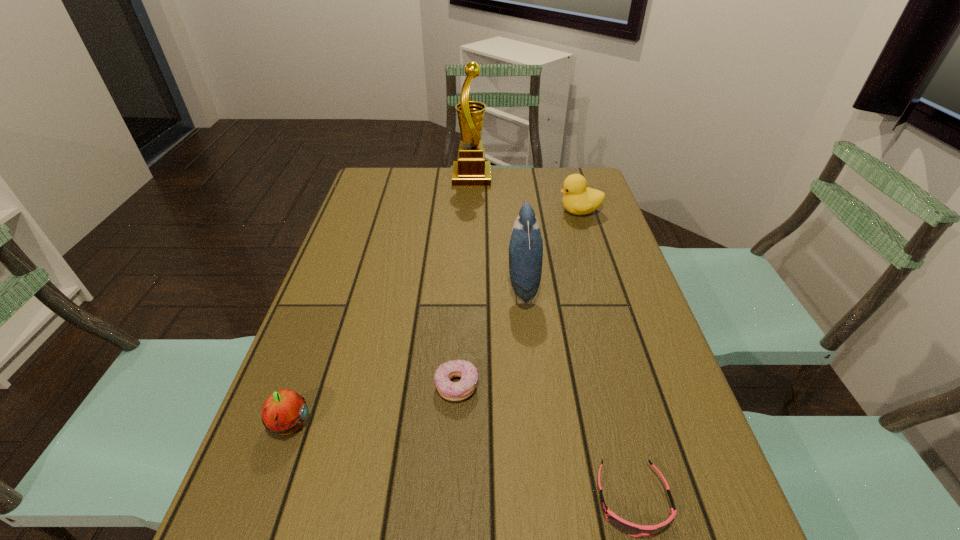
Identify the location of vacant space that's between the fourth object from left to right and the fourth shortest object. This screenshot has width=960, height=540. (551, 248).

You are a GUI agent. You are given a task and a screenshot of the screen. Output one action in this format:
    pyautogui.click(x=<x>, y=<y>)
    Task: Click on the vacant area between the apple and the tallest object
    
    Given the screenshot: What is the action you would take?
    pyautogui.click(x=380, y=301)

Where is `unoccupied area between the third tallest object and the third object from right to left`? unoccupied area between the third tallest object and the third object from right to left is located at coordinates (551, 248).

Identify which object is the nearest to the bird. Please provide its 2D coordinates. Your answer should be formatted as a tuple, i.e. [(x, y)], where the tuple contains the x and y coordinates of a point satisfying the conditions above.

[(453, 391)]

Identify which object is the nearest to the goggles. Please provide its 2D coordinates. Your answer should be formatted as a tuple, i.e. [(x, y)], where the tuple contains the x and y coordinates of a point satisfying the conditions above.

[(453, 391)]

Locate an element on the screen. free spot that satisfies the following two spatial constraints: 1. on the front-facing side of the farthest object; 2. on the front side of the fourth farthest object is located at coordinates (466, 386).

Where is `free space that satisfies the following two spatial constraints: 1. at the tip of the bird's beak; 2. on the front side of the fourth tallest object`? The width and height of the screenshot is (960, 540). free space that satisfies the following two spatial constraints: 1. at the tip of the bird's beak; 2. on the front side of the fourth tallest object is located at coordinates (538, 424).